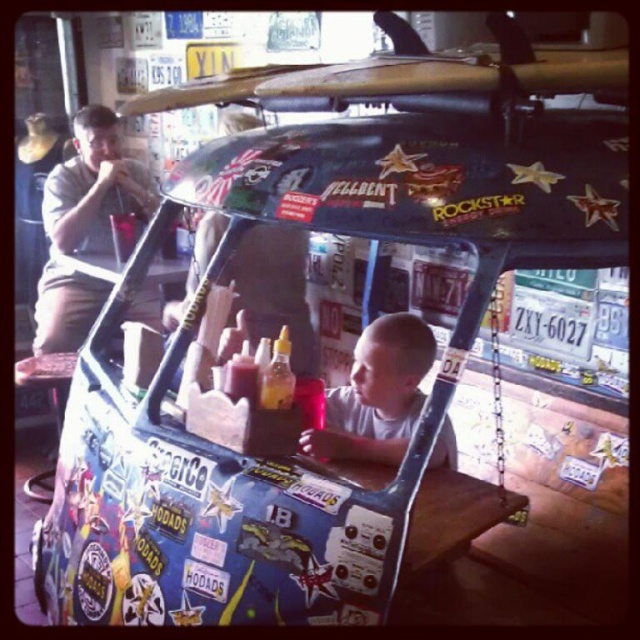
Is stickered plastic surfboard at center above matte khaki shorts at left?

No, stickered plastic surfboard at center is not above matte khaki shorts at left.

Measure the distance from stickered plastic surfboard at center to matte khaki shorts at left.

stickered plastic surfboard at center and matte khaki shorts at left are 1.66 meters apart from each other.

What do you see at coordinates (433, 180) in the screenshot?
I see `stickered plastic surfboard at center` at bounding box center [433, 180].

The image size is (640, 640). I want to click on stickered plastic surfboard at center, so click(433, 180).

Which is more to the left, stickered plastic surfboard at center or smooth skin child at center?

stickered plastic surfboard at center is more to the left.

Can you confirm if stickered plastic surfboard at center is taller than smooth skin child at center?

No, stickered plastic surfboard at center is not taller than smooth skin child at center.

Is point (452, 118) positioned behind point (307, 433)?

That is False.

The height and width of the screenshot is (640, 640). Find the location of `stickered plastic surfboard at center`. stickered plastic surfboard at center is located at coordinates coord(433,180).

Does stickered plastic surfboard at center have a larger size compared to wooden surfboard at upper center?

Yes, stickered plastic surfboard at center is bigger than wooden surfboard at upper center.

Which of these two, stickered plastic surfboard at center or wooden surfboard at upper center, stands shorter?

With less height is wooden surfboard at upper center.

Is point (301, 168) farther from viewer compared to point (208, 92)?

That is False.

Locate an element on the screen. Image resolution: width=640 pixels, height=640 pixels. stickered plastic surfboard at center is located at coordinates (433, 180).